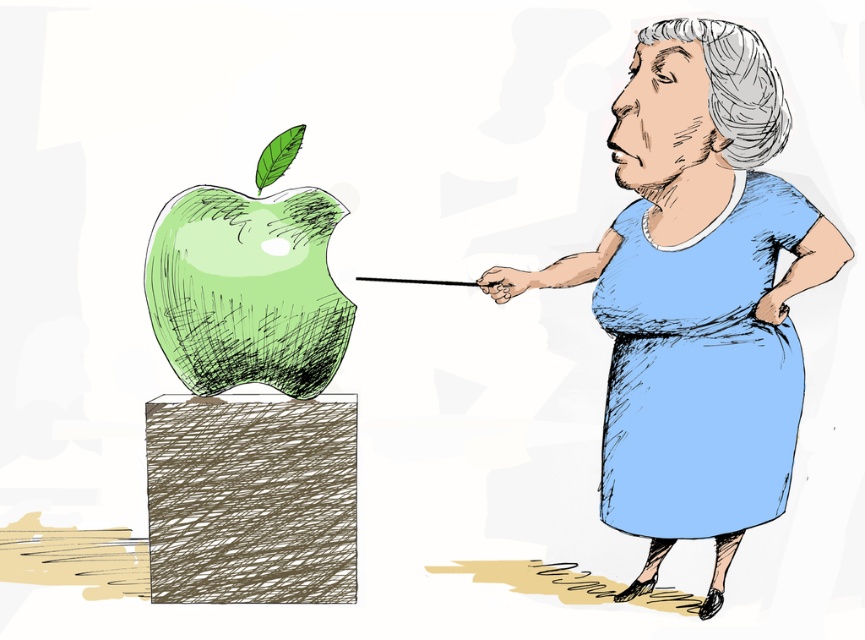
Question: Which point is farther to the camera?

Choices:
 (A) green sketched apple at center
 (B) blue fabric dress at right

Answer: (A)

Question: Can you confirm if blue fabric dress at right is bigger than green sketched apple at center?

Choices:
 (A) yes
 (B) no

Answer: (A)

Question: Which point is farther to the camera?

Choices:
 (A) (670, 90)
 (B) (165, 204)

Answer: (B)

Question: Can you confirm if blue fabric dress at right is wider than green sketched apple at center?

Choices:
 (A) yes
 (B) no

Answer: (A)

Question: Does blue fabric dress at right appear over green sketched apple at center?

Choices:
 (A) yes
 (B) no

Answer: (A)